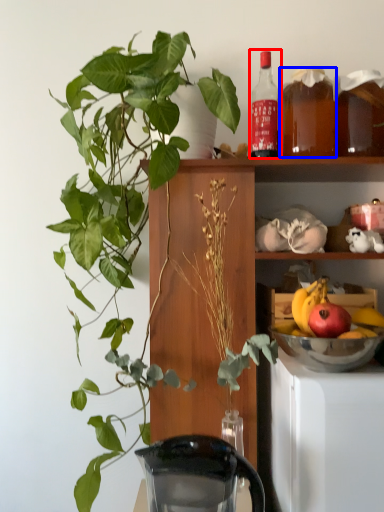
Question: Among these objects, which one is farthest to the camera, bottle (highlighted by a red box) or beverage (highlighted by a blue box)?

Choices:
 (A) bottle
 (B) beverage

Answer: (A)